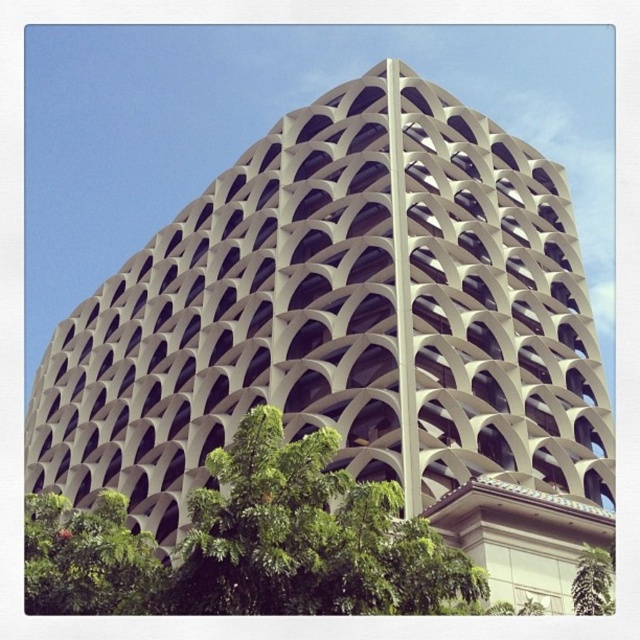
Question: Which point is farther from the camera taking this photo?

Choices:
 (A) (67, 540)
 (B) (609, 602)

Answer: (B)

Question: Which object appears farthest from the camera in this image?

Choices:
 (A) green leafy tree at lower left
 (B) green leafy tree at lower right

Answer: (B)

Question: Is green leafy tree at lower left to the left of green leafy tree at lower right from the viewer's perspective?

Choices:
 (A) no
 (B) yes

Answer: (B)

Question: Is green leafy tree at lower left closer to camera compared to green leafy tree at lower right?

Choices:
 (A) no
 (B) yes

Answer: (B)

Question: Can you confirm if green leafy tree at lower left is positioned to the right of green leafy tree at lower right?

Choices:
 (A) yes
 (B) no

Answer: (B)

Question: Which point is farther to the camera?

Choices:
 (A) (580, 561)
 (B) (58, 525)

Answer: (A)